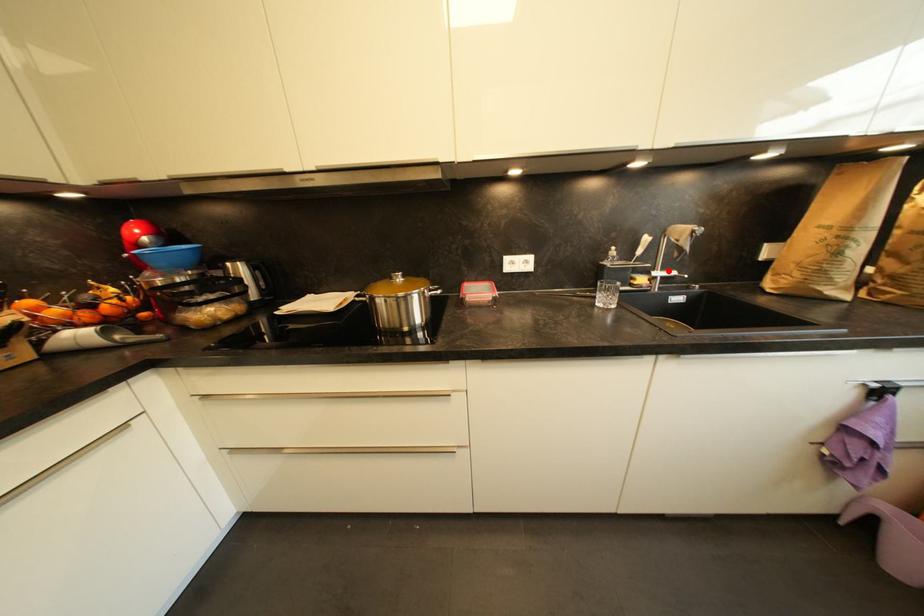
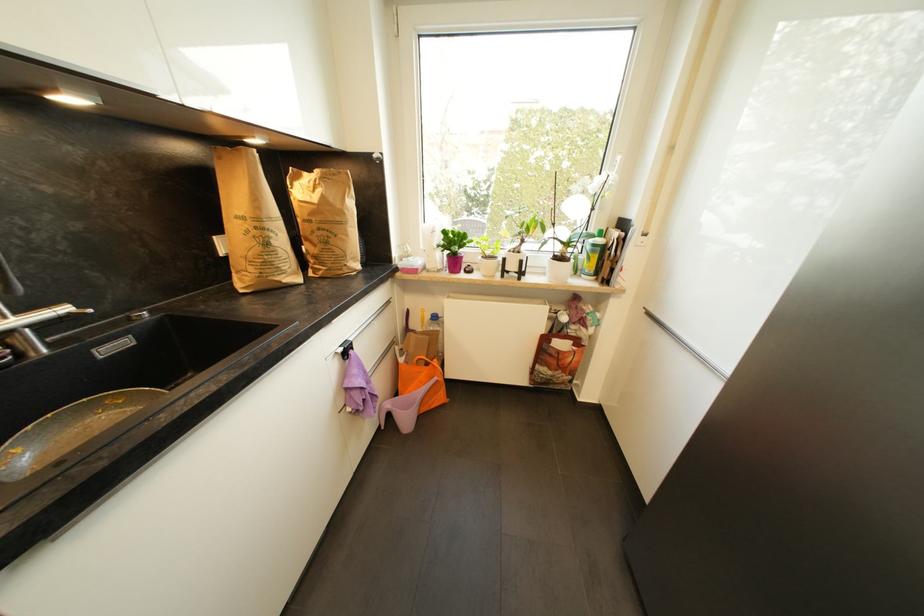
Locate, in the second image, the point that corresponds to the highlighted location in the first image.

(27, 313)